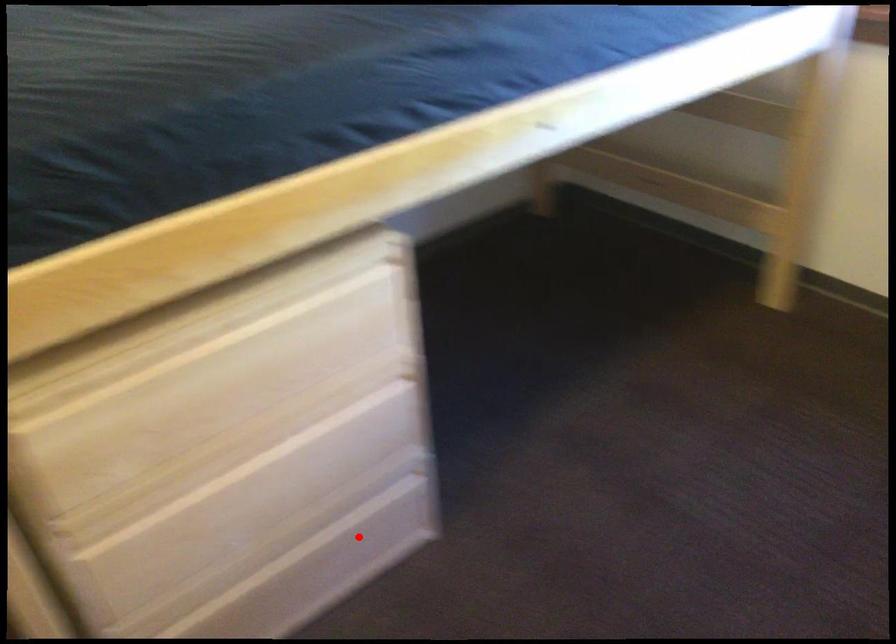
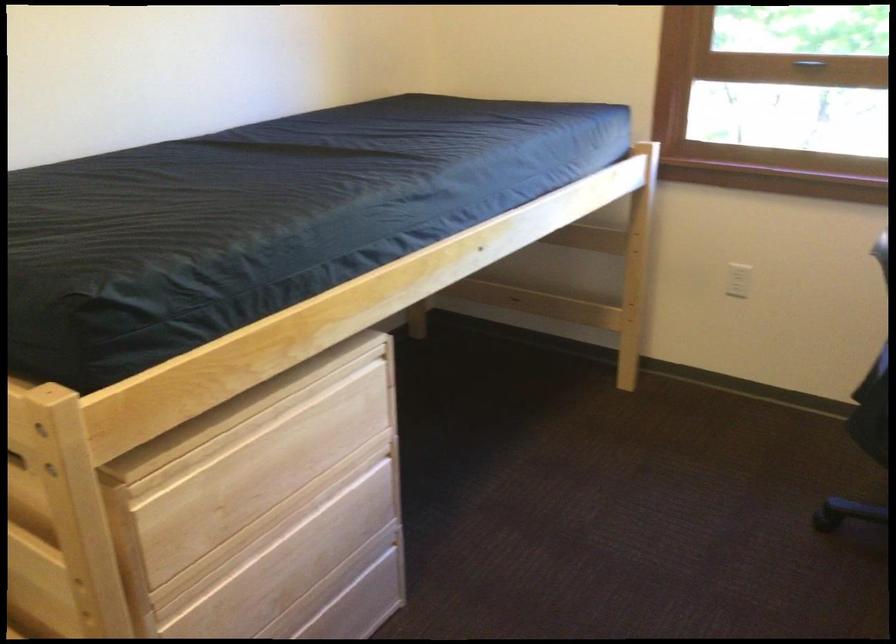
Question: I am providing you with two images of the same scene from different viewpoints. Given a red point in image1, look at the same physical point in image2. Is it:

Choices:
 (A) Closer to the viewpoint
 (B) Farther from the viewpoint

Answer: (B)